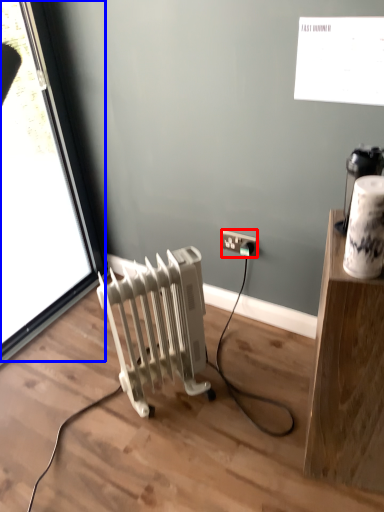
Question: Which of the following is the closest to the observer, power plugs and sockets (highlighted by a red box) or window (highlighted by a blue box)?

Choices:
 (A) power plugs and sockets
 (B) window

Answer: (B)